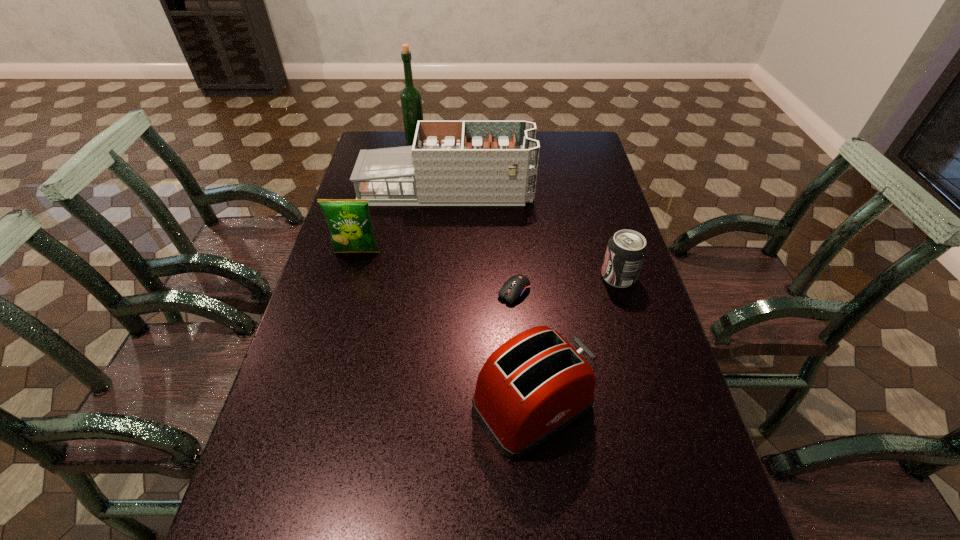
Find the location of a particular element. The width and height of the screenshot is (960, 540). object that is the nearest to the toaster is located at coordinates (518, 286).

Locate an element on the screen. object that is the fourth nearest to the crisp (potato chip) is located at coordinates (411, 102).

Find the location of a particular element. Image resolution: width=960 pixels, height=540 pixels. free location that satisfies the following two spatial constraints: 1. on the back side of the nearest object; 2. on the left side of the rightmost object is located at coordinates (520, 276).

In order to click on vacant region that satisfies the following two spatial constraints: 1. at the entrance of the dollhouse; 2. on the back side of the computer mouse in this screenshot , I will do `click(438, 292)`.

Identify the location of free space in the image that satisfies the following two spatial constraints: 1. at the entrance of the second farthest object; 2. on the right side of the toaster. This screenshot has height=540, width=960. (427, 406).

At what (x,y) coordinates should I click in order to perform the action: click on free space in the image that satisfies the following two spatial constraints: 1. at the entrance of the dollhouse; 2. on the right side of the nearest object. Please return your answer as a coordinate pair (x, y). Looking at the image, I should click on (427, 406).